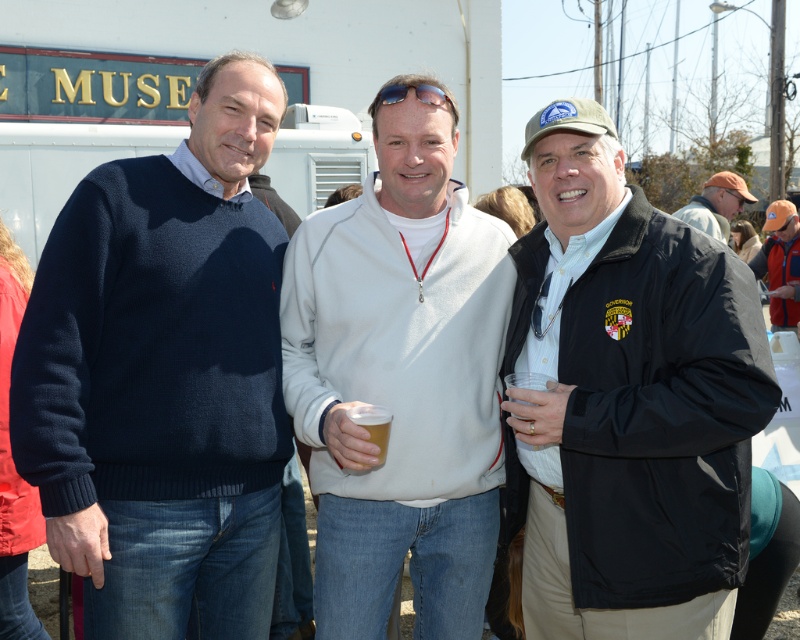
Between point (262, 561) and point (377, 424), which one is positioned in front?

Point (377, 424)

Is navy blue sweater at left positioned behind translucent plastic cup at center?

That is False.

Image resolution: width=800 pixels, height=640 pixels. I want to click on navy blue sweater at left, so click(164, 376).

Can you confirm if black matte jacket at center is thinner than white fleece jacket at center?

Correct, black matte jacket at center's width is less than white fleece jacket at center's.

Who is more forward, (588, 525) or (478, 214)?

Point (588, 525)

The height and width of the screenshot is (640, 800). I want to click on black matte jacket at center, so click(x=628, y=401).

Can you confirm if black matte jacket at center is positioned to the left of translucent plastic cup at center?

No, black matte jacket at center is not to the left of translucent plastic cup at center.

Does point (714, 544) come farther from viewer compared to point (382, 460)?

No, it is in front of (382, 460).

This screenshot has width=800, height=640. Describe the element at coordinates (628, 401) in the screenshot. I see `black matte jacket at center` at that location.

You are a GUI agent. You are given a task and a screenshot of the screen. Output one action in this format:
    pyautogui.click(x=<x>, y=<y>)
    Task: Click on the black matte jacket at center
    
    Given the screenshot: What is the action you would take?
    pyautogui.click(x=628, y=401)